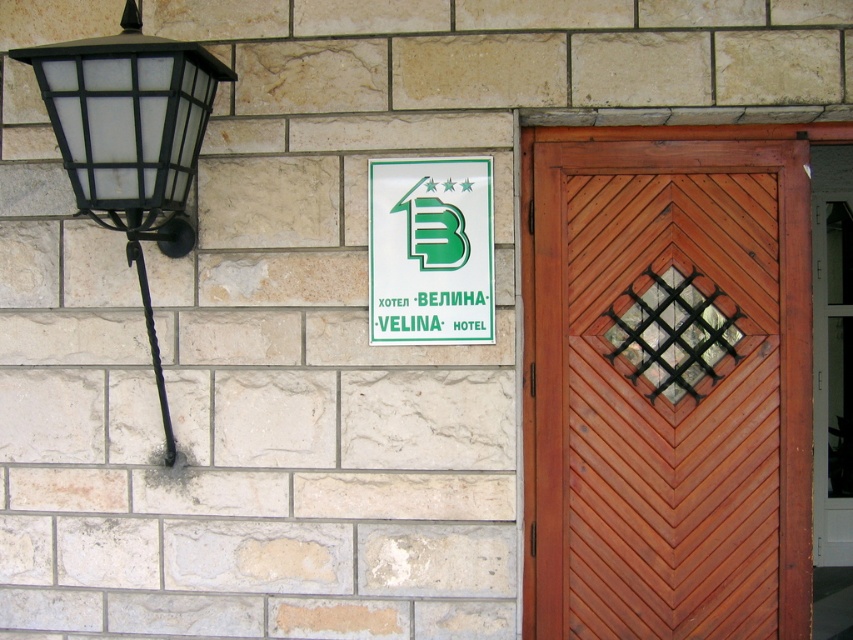
You are standing in front of the building and want to enter through the mahogany wood door at right. However, there is a white plastic sign at upper center blocking your view of the door handle. Can you reach the door handle without moving the sign?

The mahogany wood door at right is further to the viewer than the white plastic sign at upper center, so the sign is closer to you. This means the sign is in front of the door, potentially blocking access to the handle. You would need to move the sign to reach the handle.

You are a window cleaner with a 1.2 meter ladder. You need to clean both the matte glass wall lamp at left and the white plastic sign at upper center. Given the ladder height, which object can you reach without needing a taller ladder?

The matte glass wall lamp at left has a larger size compared to the white plastic sign at upper center. Since the ladder is 1.2 meters tall, you can reach both objects. However, the sign at upper center may require more precise work due to its smaller size and higher position.